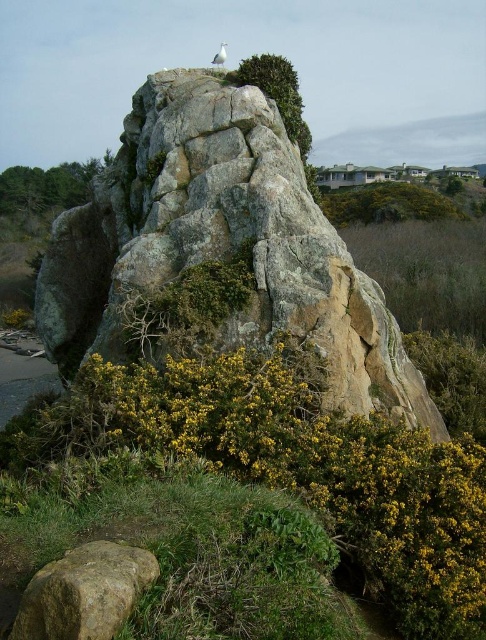
You are a botanist studying plant growth in rocky environments. You observe the green leafy tree at left and the green leafy shrub at upper center. Which of these two plants has a wider spread in terms of its foliage coverage?

The green leafy tree at left has a wider spread in its foliage coverage compared to the green leafy shrub at upper center, as its width is larger than the shrub.

Consider the image. You are a photographer standing at the base of the rocky outcrop. You want to capture both the point at coordinates point [56,596] and point [346,216] in your photo. Since you can only focus on one point clearly, which point should you focus on to ensure the other point remains in the background?

You should focus on point [56,596] because it is closer to the camera than point [346,216]. By focusing on the closer point, the farther point will naturally fall into the background of the image.